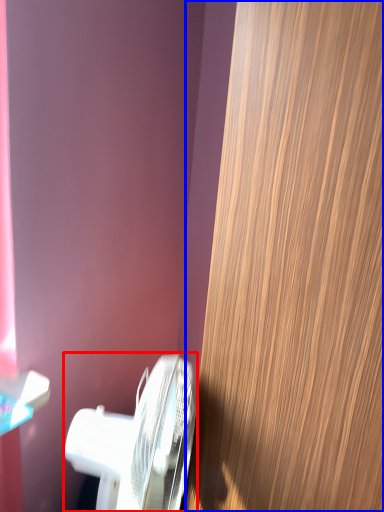
Question: Which of the following is the farthest to the observer, toilet (highlighted by a red box) or door (highlighted by a blue box)?

Choices:
 (A) toilet
 (B) door

Answer: (A)